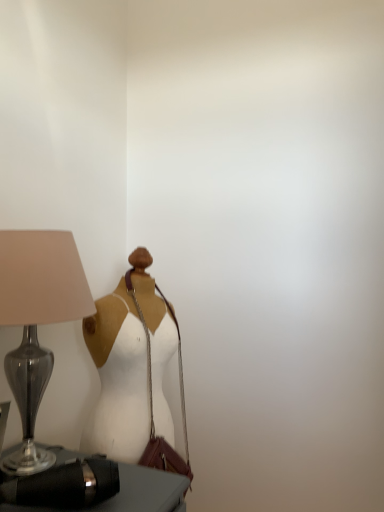
Question: Is white matte dress at center in contact with leather shoulder bag at center?

Choices:
 (A) yes
 (B) no

Answer: (A)

Question: Considering the relative positions of white matte dress at center and leather shoulder bag at center in the image provided, is white matte dress at center to the right of leather shoulder bag at center from the viewer's perspective?

Choices:
 (A) yes
 (B) no

Answer: (B)

Question: Is white matte dress at center oriented towards leather shoulder bag at center?

Choices:
 (A) yes
 (B) no

Answer: (A)

Question: From the image's perspective, is white matte dress at center above leather shoulder bag at center?

Choices:
 (A) yes
 (B) no

Answer: (A)

Question: Is white matte dress at center in front of leather shoulder bag at center?

Choices:
 (A) no
 (B) yes

Answer: (B)

Question: Is white matte dress at center smaller than leather shoulder bag at center?

Choices:
 (A) yes
 (B) no

Answer: (B)

Question: Is white matte dress at center located within leather shoulder bag at center?

Choices:
 (A) yes
 (B) no

Answer: (A)

Question: Is leather shoulder bag at center shorter than white matte dress at center?

Choices:
 (A) no
 (B) yes

Answer: (B)

Question: Is leather shoulder bag at center closer to the viewer compared to white matte dress at center?

Choices:
 (A) yes
 (B) no

Answer: (B)

Question: Is leather shoulder bag at center located outside white matte dress at center?

Choices:
 (A) yes
 (B) no

Answer: (B)

Question: From the image's perspective, is leather shoulder bag at center under white matte dress at center?

Choices:
 (A) no
 (B) yes

Answer: (B)

Question: Is leather shoulder bag at center beside white matte dress at center?

Choices:
 (A) yes
 (B) no

Answer: (A)

Question: Is matte glass lamp at left positioned in front of black leather bag at lower left?

Choices:
 (A) no
 (B) yes

Answer: (A)